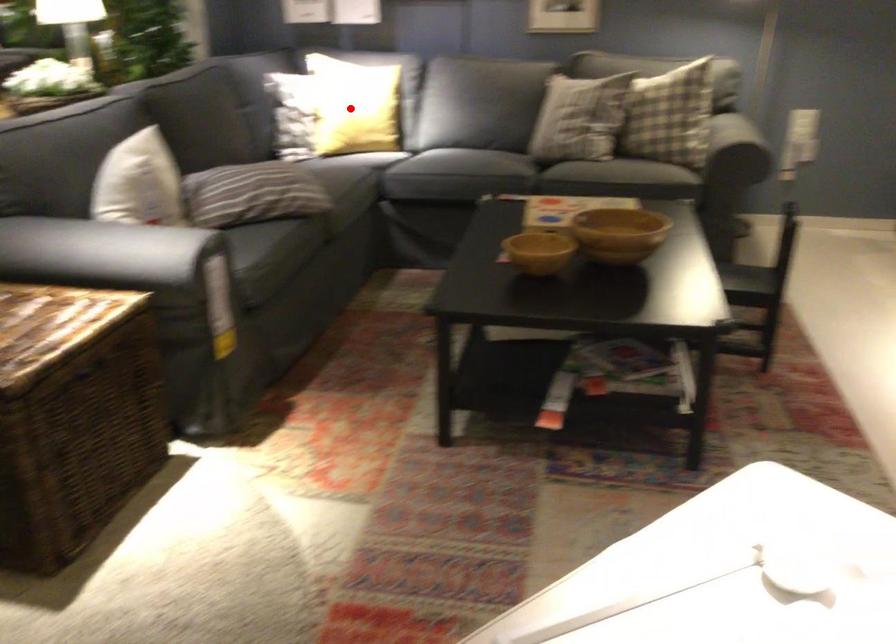
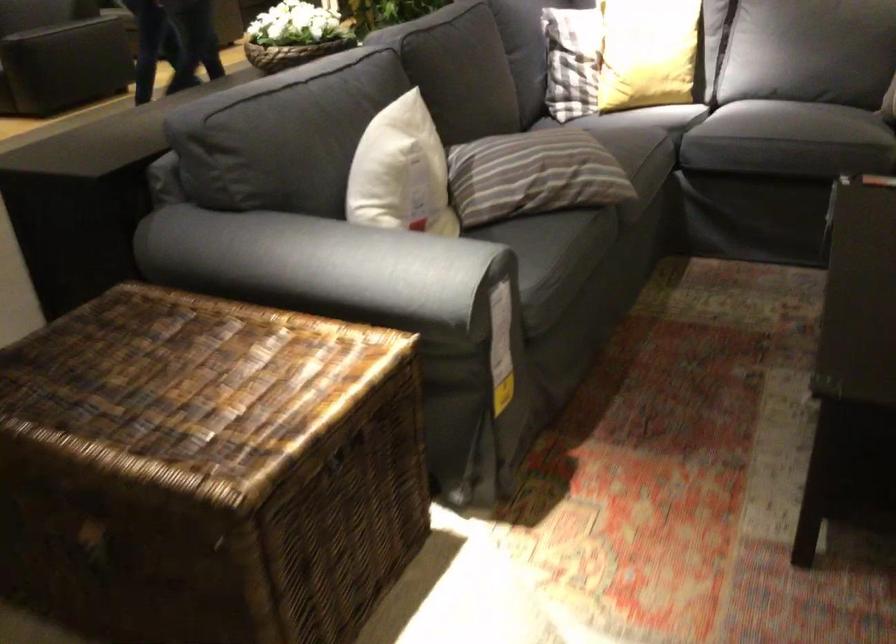
Question: A red point is marked in image1. In image2, is the corresponding 3D point closer to the camera or farther? Reply with the corresponding letter.

Choices:
 (A) The corresponding 3D point is closer.
 (B) The corresponding 3D point is farther.

Answer: (A)